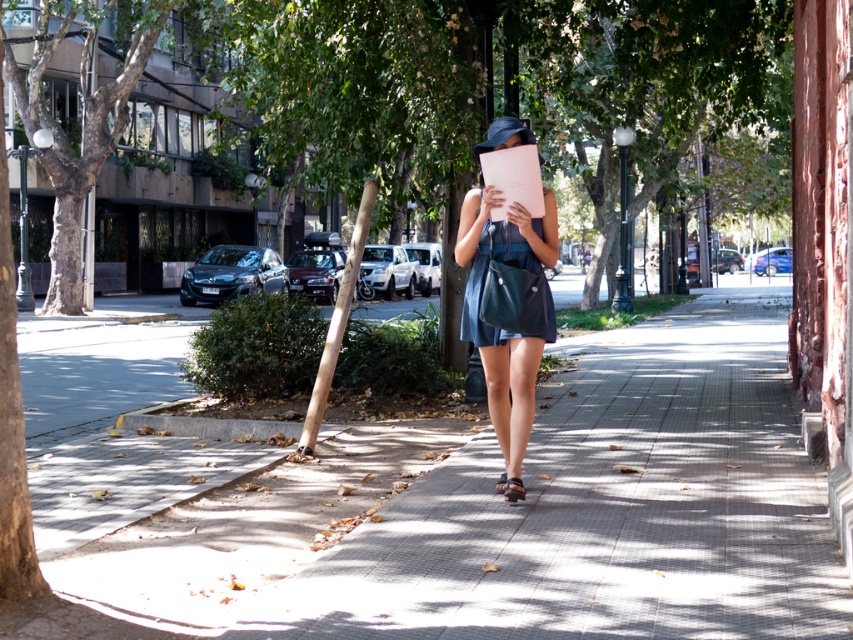
Based on the photo, you are standing on the sidewalk and see the smooth concrete pavement at center and the brown leather sandal at center. Which object is located to the right of the other?

The smooth concrete pavement at center is positioned on the right side of brown leather sandal at center.

You are a pedestrian standing on the sidewalk and see the smooth concrete pavement at center and the denim dress at center. Which object is closer to the ground?

The smooth concrete pavement at center is closer to the ground because it is below the denim dress at center.

You are a photographer trying to capture the woman in the scene. You want to ensure that both brown leather sandal at center and brown leather sandal at lower center are visible in the frame. Given that your camera has a minimum focus distance of 3.5 inches, can you focus on both sandals at the same time?

The brown leather sandal at center is 4.02 inches from brown leather sandal at lower center. Since the distance between them is greater than the camera minimum focus distance of 3.5 inches, the camera can focus on both sandals at the same time.